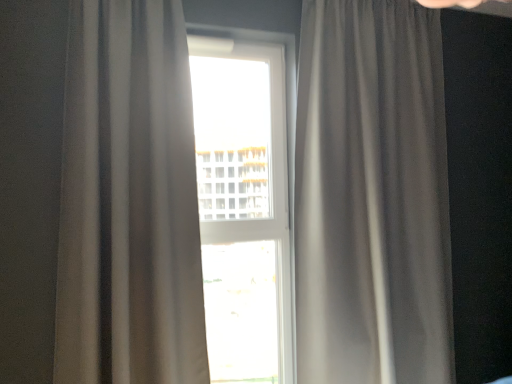
Question: In terms of height, does satin gray curtain at right, which appears as the 2th curtain when viewed from the left, look taller or shorter compared to matte gray curtain at center, arranged as the 1th curtain when viewed from the left?

Choices:
 (A) tall
 (B) short

Answer: (A)

Question: Looking at the image, does satin gray curtain at right, which is the 1th curtain in right-to-left order, seem bigger or smaller compared to matte gray curtain at center, arranged as the 1th curtain when viewed from the left?

Choices:
 (A) big
 (B) small

Answer: (A)

Question: Estimate the real-world distances between objects in this image. Which object is closer to the satin gray curtain at right, which appears as the 2th curtain when viewed from the left?

Choices:
 (A) matte gray curtain at center, arranged as the 1th curtain when viewed from the left
 (B) transparent glass window at center

Answer: (A)

Question: Based on their relative distances, which object is nearer to the matte gray curtain at center, arranged as the 1th curtain when viewed from the left?

Choices:
 (A) transparent glass window at center
 (B) satin gray curtain at right, which is the 1th curtain in right-to-left order

Answer: (B)